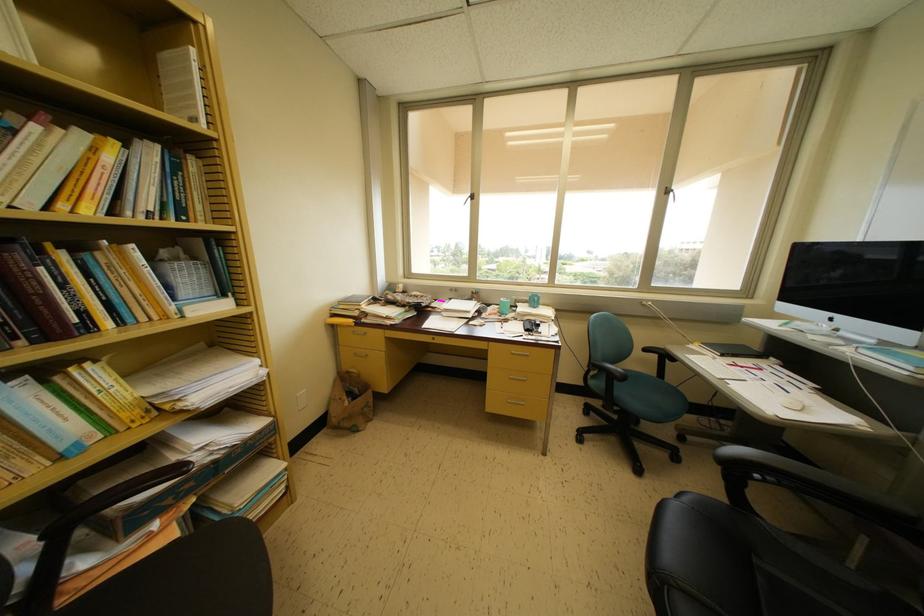
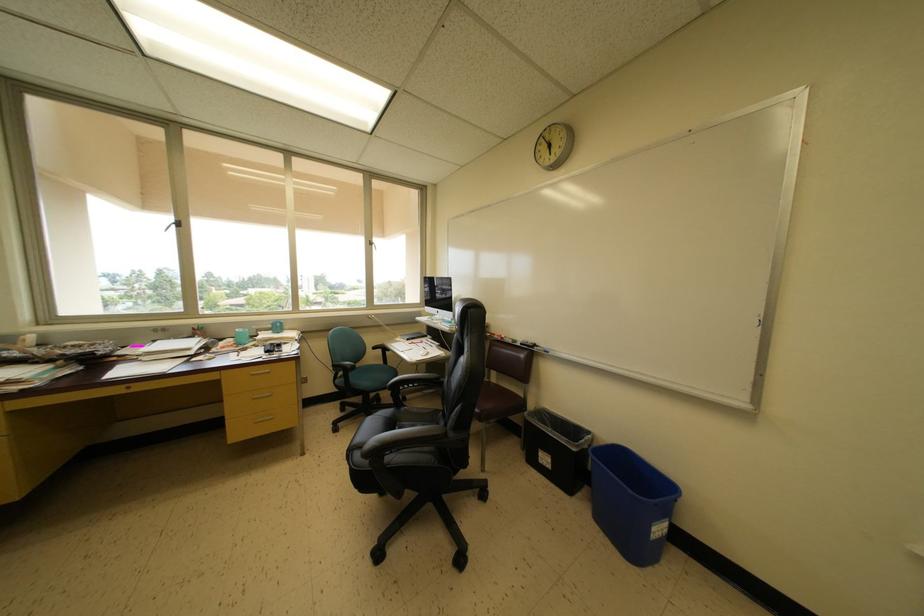
The point at (x=476, y=199) is marked in the first image. Where is the corresponding point in the second image?

(179, 225)